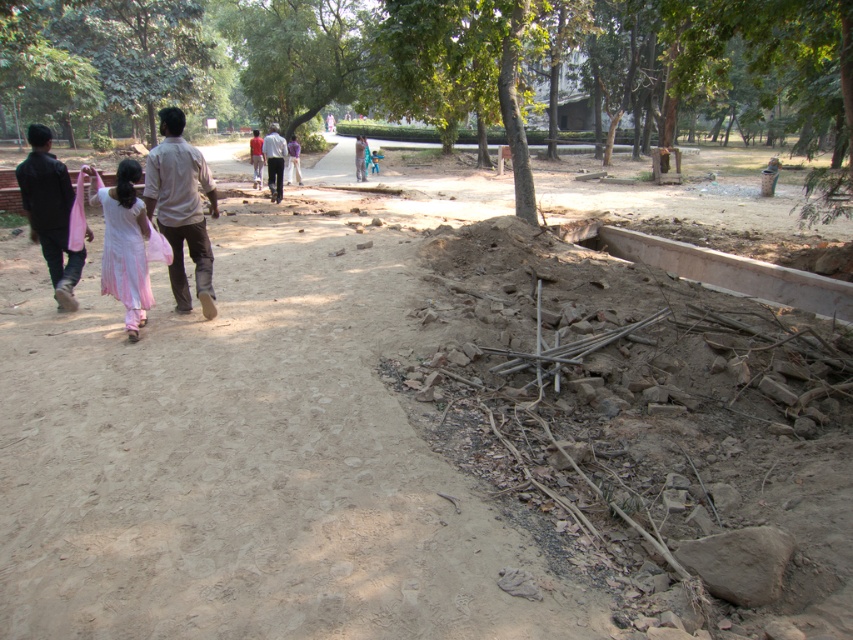
Based on the photo, is light brown shirt at center to the right of black matte jacket at left from the viewer's perspective?

Indeed, light brown shirt at center is positioned on the right side of black matte jacket at left.

Does light brown shirt at center appear under black matte jacket at left?

Correct, light brown shirt at center is located below black matte jacket at left.

Find the location of a particular element. light brown shirt at center is located at coordinates 181,208.

Can you confirm if white cotton dress at left is bigger than light beige cotton shirt at center?

Incorrect, white cotton dress at left is not larger than light beige cotton shirt at center.

Which of these two, white cotton dress at left or light beige cotton shirt at center, stands taller?

light beige cotton shirt at center

Is point (119, 291) in front of point (276, 154)?

Yes, point (119, 291) is in front of point (276, 154).

I want to click on white cotton dress at left, so click(x=125, y=244).

Who is taller, light brown shirt at center or white cotton dress at left?

white cotton dress at left is taller.

Which is more to the right, light brown shirt at center or white cotton dress at left?

From the viewer's perspective, light brown shirt at center appears more on the right side.

Is point (183, 161) in front of point (109, 195)?

That is False.

Where is `light brown shirt at center`? light brown shirt at center is located at coordinates (181, 208).